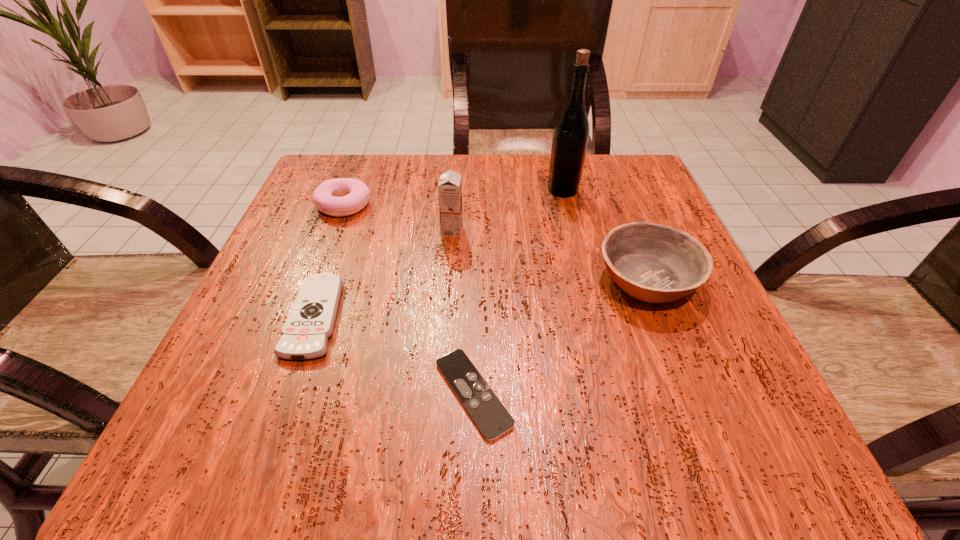
Where is `object located at the right edge`? object located at the right edge is located at coordinates (653, 263).

I want to click on object located in the far left corner section of the desktop, so click(342, 196).

The image size is (960, 540). I want to click on vacant area at the far edge of the desktop, so click(432, 154).

Where is `free space at the near edge`? The height and width of the screenshot is (540, 960). free space at the near edge is located at coordinates (468, 413).

Where is `blank area at the left edge`? The image size is (960, 540). blank area at the left edge is located at coordinates (264, 374).

Find the location of a particular element. The image size is (960, 540). vacant space at the right edge of the desktop is located at coordinates (592, 222).

Locate an element on the screen. The width and height of the screenshot is (960, 540). vacant space at the far left corner of the desktop is located at coordinates (341, 158).

You are a GUI agent. You are given a task and a screenshot of the screen. Output one action in this format:
    pyautogui.click(x=<x>, y=<y>)
    Task: Click on the vacant space at the near left corner of the desktop
    This screenshot has height=540, width=960.
    Given the screenshot: What is the action you would take?
    pyautogui.click(x=193, y=454)

Find the location of a particular element. The height and width of the screenshot is (540, 960). free space at the far right corner of the desktop is located at coordinates (591, 184).

You are a GUI agent. You are given a task and a screenshot of the screen. Output one action in this format:
    pyautogui.click(x=<x>, y=<y>)
    Task: Click on the vacant area that lies between the tallest object and the third farthest object
    
    Given the screenshot: What is the action you would take?
    pyautogui.click(x=508, y=211)